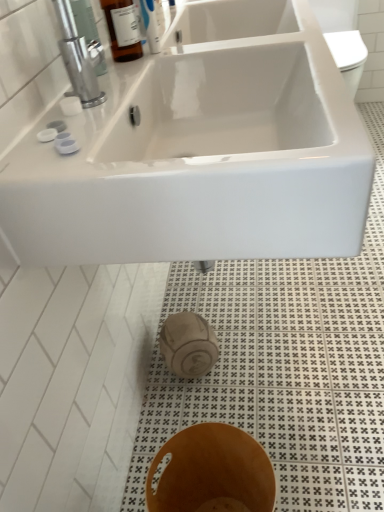
Question: From their relative heights in the image, would you say metallic silver faucet at upper left is taller or shorter than white glossy sink at upper center?

Choices:
 (A) short
 (B) tall

Answer: (A)

Question: Choose the correct answer: Is metallic silver faucet at upper left inside white glossy sink at upper center or outside it?

Choices:
 (A) inside
 (B) outside

Answer: (B)

Question: Which object is positioned farthest from the white glossy sink at upper center?

Choices:
 (A) metallic silver faucet at upper left
 (B) brown wood bidet at lower center

Answer: (B)

Question: Based on their relative distances, which object is farther from the white glossy sink at upper center?

Choices:
 (A) brown wood bidet at lower center
 (B) metallic silver faucet at upper left

Answer: (A)